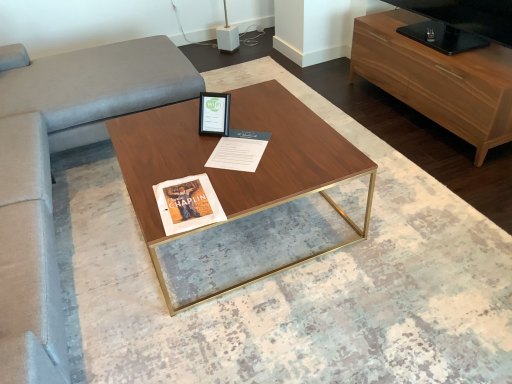
Identify the location of free space in front of matte black picture frame at center. The height and width of the screenshot is (384, 512). (211, 147).